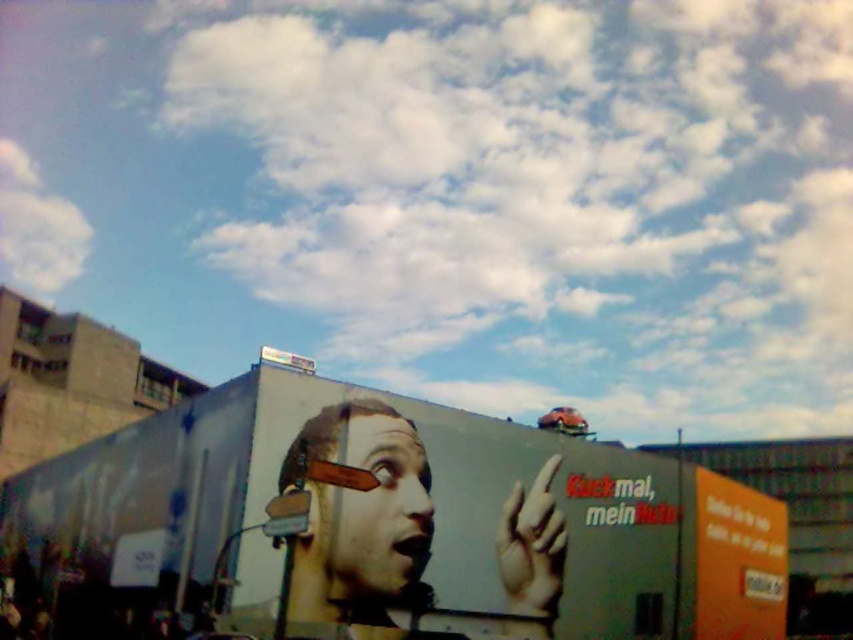
You are standing in front of the billboard advertisement and see two points marked on it. The first point is at coordinates point (390,449) and the second point is at point (778,616). Which point is closer to you?

Point (390,449) is in front of point (778,616), so it is closer to you.

You are an artist analyzing the proportions in the billboard advertisement. You notice the smooth skin face at center and the smooth beige hand at lower center. Which object has a greater width?

The smooth skin face at center has a greater width than the smooth beige hand at lower center.